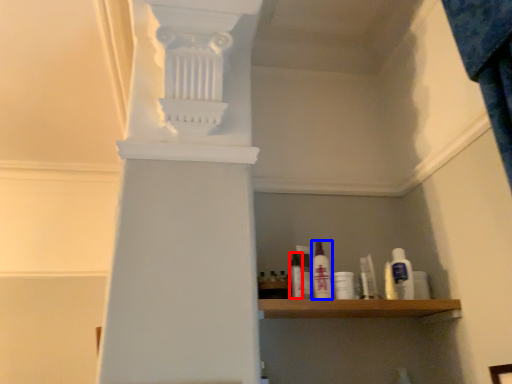
Question: Which of the following is the closest to the observer, toiletry (highlighted by a red box) or toiletry (highlighted by a blue box)?

Choices:
 (A) toiletry
 (B) toiletry

Answer: (A)